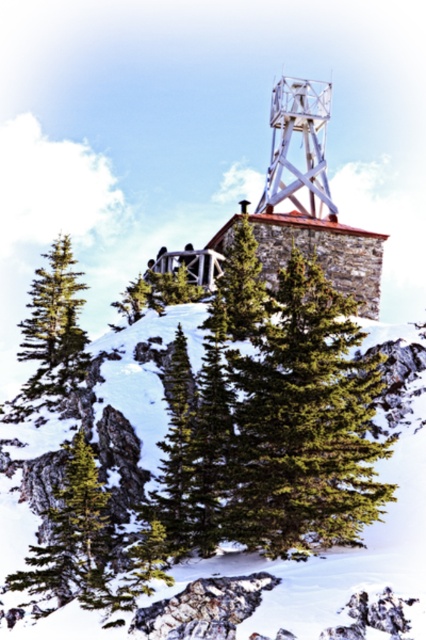
You are an observer standing at the base of the mountain looking up towards the fire lookout tower. Which object is closer to you, the white fluffy snow at center or the green matte evergreen tree at left?

The white fluffy snow at center is closer to you because it is in front of the green matte evergreen tree at left.

What are the coordinates of the green matte evergreen tree at left in the image?

The green matte evergreen tree at left is located at coordinates (54, 326).